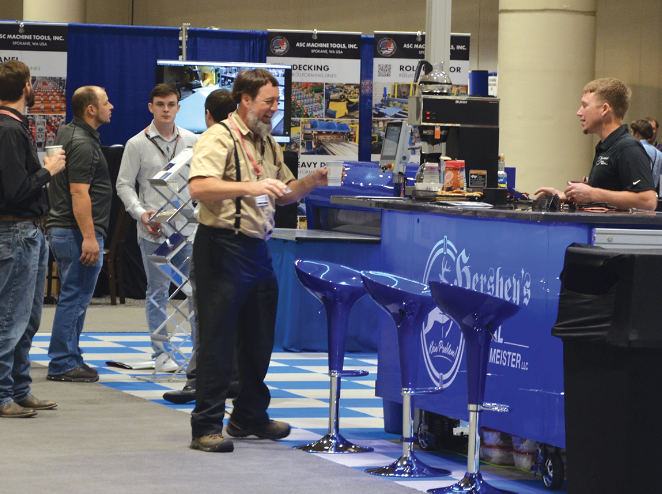
Find the location of a particular element. blue and white floor tiled floor is located at coordinates (305, 389), (298, 414), (145, 391), (112, 342).